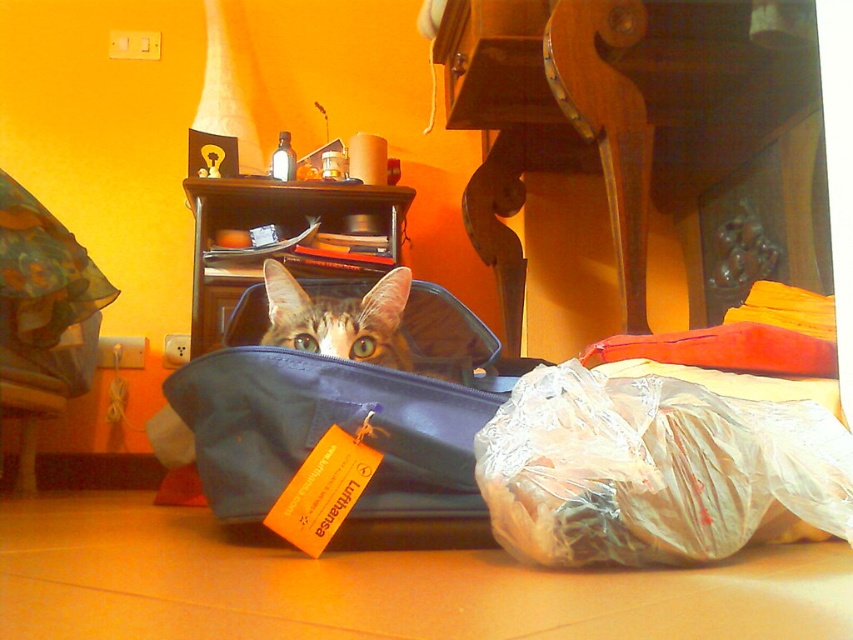
You are organizing items on a shelf. You have a transparent plastic bag at center and a tabby fur cat at center. Which item is taller?

The transparent plastic bag at center is taller than the tabby fur cat at center according to the description.

You are standing in the room and see two points marked in the image. Which point is closer to you, point [612,468] or point [239,369]?

Point [612,468] is in front of point [239,369], so it is closer to you.

In the scene, there is a transparent plastic bag at center and a blue fabric bag at center. Which one has a smaller height?

The transparent plastic bag at center has a lesser height compared to the blue fabric bag at center.